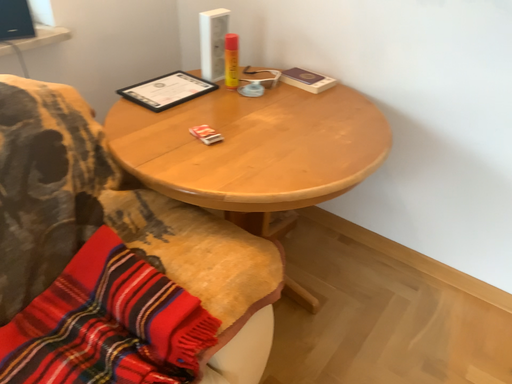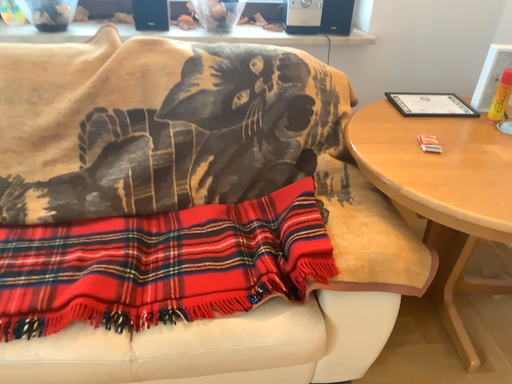
Question: How did the camera likely rotate when shooting the video?

Choices:
 (A) rotated downward
 (B) rotated upward

Answer: (B)